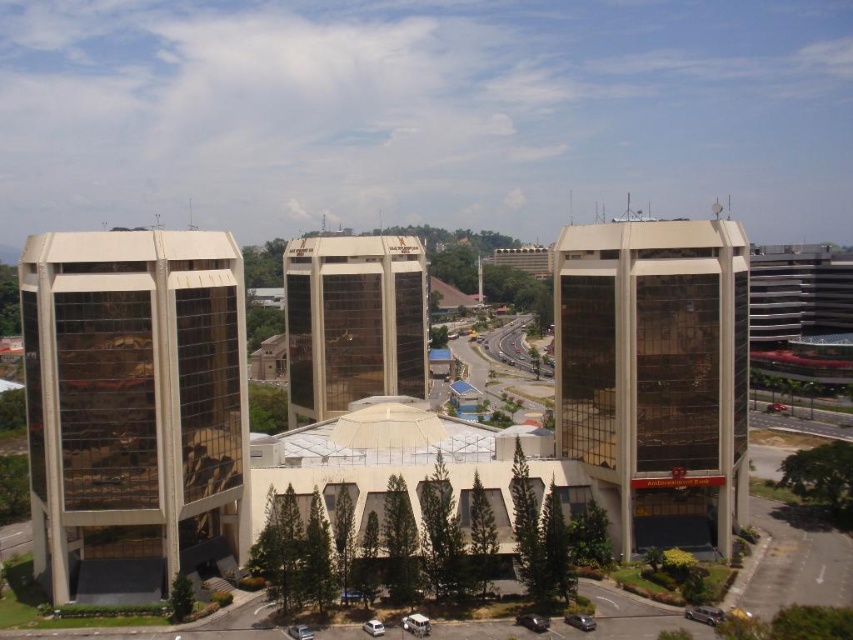
You are standing in the parking lot looking at the three high rise buildings. There are two points marked on the ground in front of you. One is at coordinate point (706,280) and the other is at (289,412). Which point is closer to you?

Point (706,280) is closer to the viewer than point (289,412).

You are standing in front of the three high rise buildings in the scene. You notice two buildings labeled as matte glass building at center and gold reflective glass building at center. Which one appears to be in front of the other?

The matte glass building at center is positioned over gold reflective glass building at center, so the matte glass building at center appears to be in front of the gold reflective glass building at center.